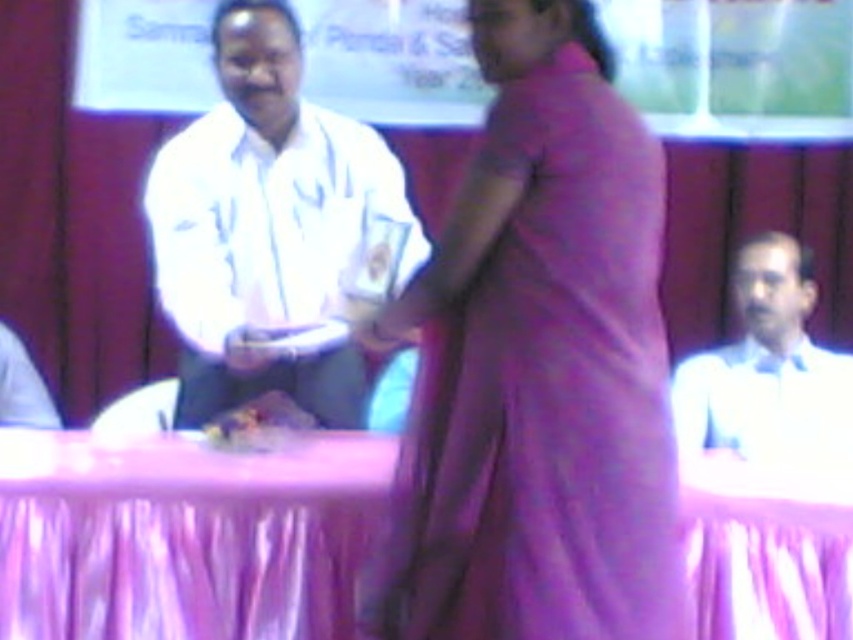
You are a photographer at the event and need to capture a clear photo of the purple fabric table at center and the smooth plastic food at center. Based on their positions, which object is directly above the other?

The smooth plastic food at center is directly above the purple fabric table at center because the description states that the purple fabric table is positioned under the smooth plastic food.

You are attending a formal event and notice two people in the scene. One is wearing a purple fabric dress at center and the other is wearing a white shirt at right. Based on their positions, which one is closer to the front of the image?

The purple fabric dress at center is above the white shirt at right, indicating it is closer to the front of the image.

You are attending a formal event and see the purple fabric table at center and the smooth plastic food at center. From your perspective, which object is positioned to the left?

The purple fabric table at center is positioned to the left of the smooth plastic food at center.